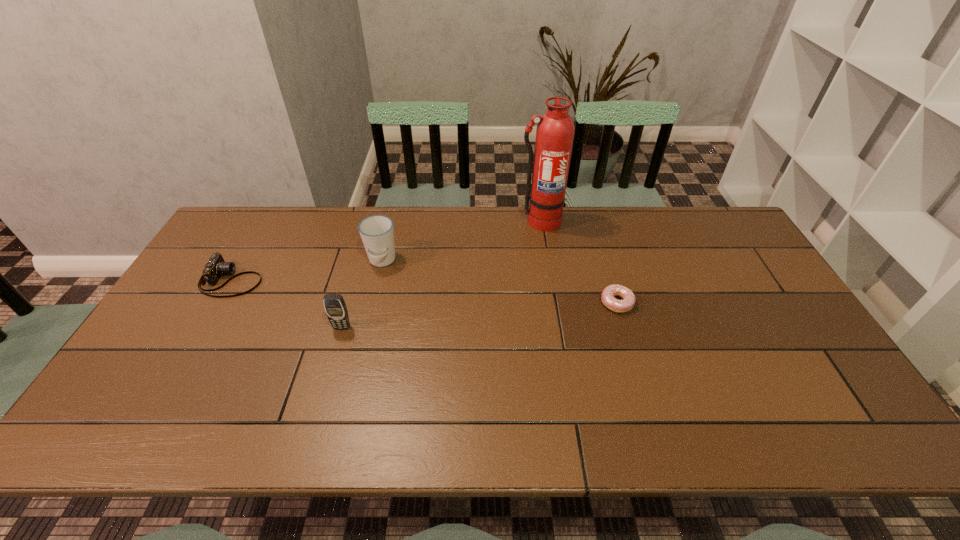
This screenshot has width=960, height=540. In order to click on blank region between the nearest object and the fire extinguisher in this screenshot , I will do `click(441, 274)`.

Identify the location of vacant area between the cellular telephone and the fourth tallest object. (287, 303).

At what (x,y) coordinates should I click in order to perform the action: click on unoccupied position between the cup and the doughnut. Please return your answer as a coordinate pair (x, y). The image size is (960, 540). Looking at the image, I should click on (499, 282).

Where is `vacant space in between the tallest object and the nearest object`? vacant space in between the tallest object and the nearest object is located at coordinates (441, 274).

Where is `vacant space in between the shortest object and the cup`? This screenshot has width=960, height=540. vacant space in between the shortest object and the cup is located at coordinates (499, 282).

At what (x,y) coordinates should I click in order to perform the action: click on free spot between the shortest object and the fire extinguisher. Please return your answer as a coordinate pair (x, y). The height and width of the screenshot is (540, 960). Looking at the image, I should click on tap(578, 262).

Find the location of a particular element. free space between the farthest object and the doughnut is located at coordinates (578, 262).

At what (x,y) coordinates should I click in order to perform the action: click on vacant space that is in between the doughnut and the leftmost object. Please return your answer as a coordinate pair (x, y). Looking at the image, I should click on (424, 291).

Find the location of a particular element. Image resolution: width=960 pixels, height=540 pixels. free space between the doughnut and the nearest object is located at coordinates (479, 315).

In order to click on the third closest object to the tallest object in this screenshot , I will do `click(334, 304)`.